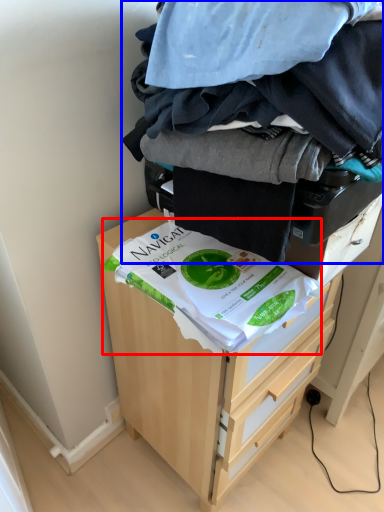
Question: Among these objects, which one is farthest to the camera, food (highlighted by a red box) or laundry (highlighted by a blue box)?

Choices:
 (A) food
 (B) laundry

Answer: (A)